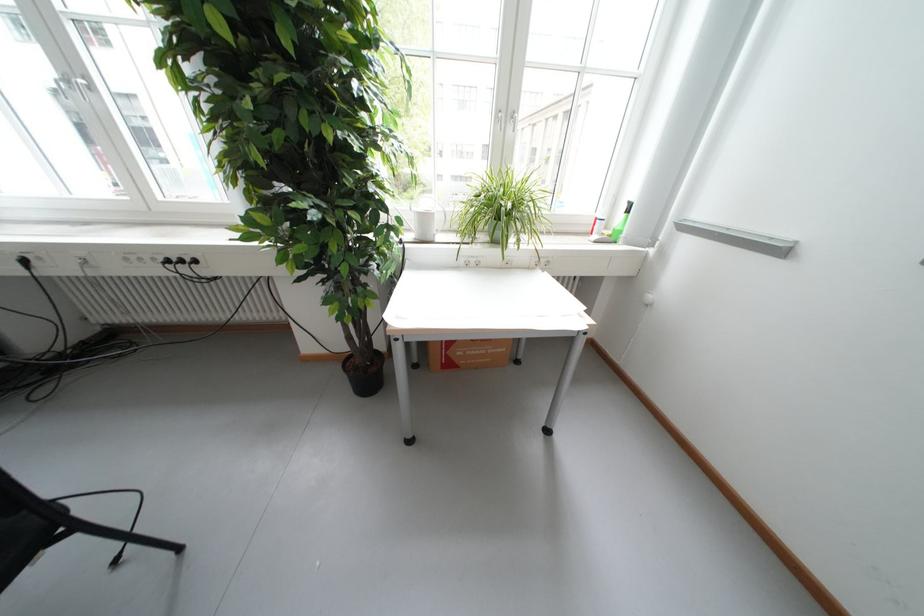
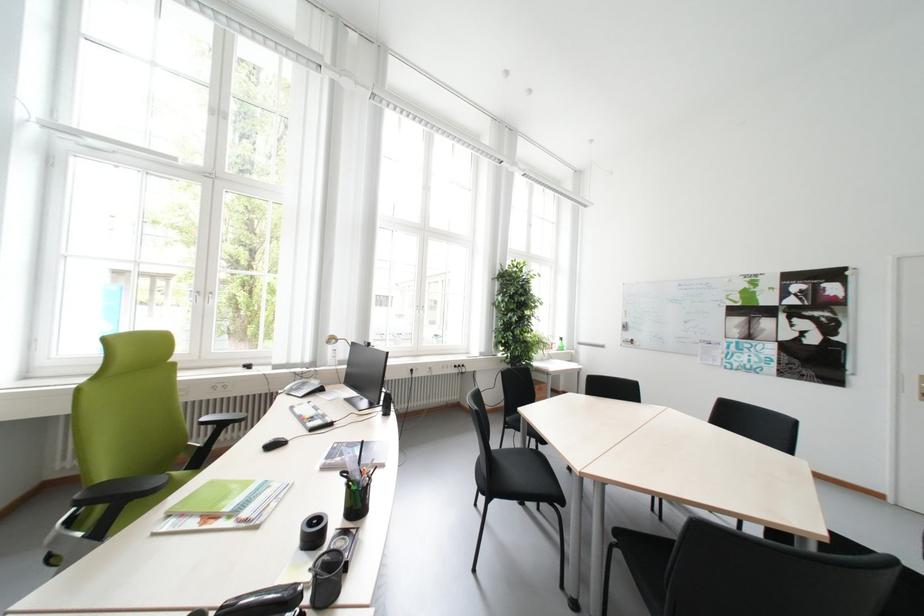
Question: I am providing you with two images of the same scene from different viewpoints. Which of the following objects are not visible in image2?

Choices:
 (A) white window handle
 (B) cardboard box
 (C) black computer mouse
 (D) white lidded jar

Answer: (B)